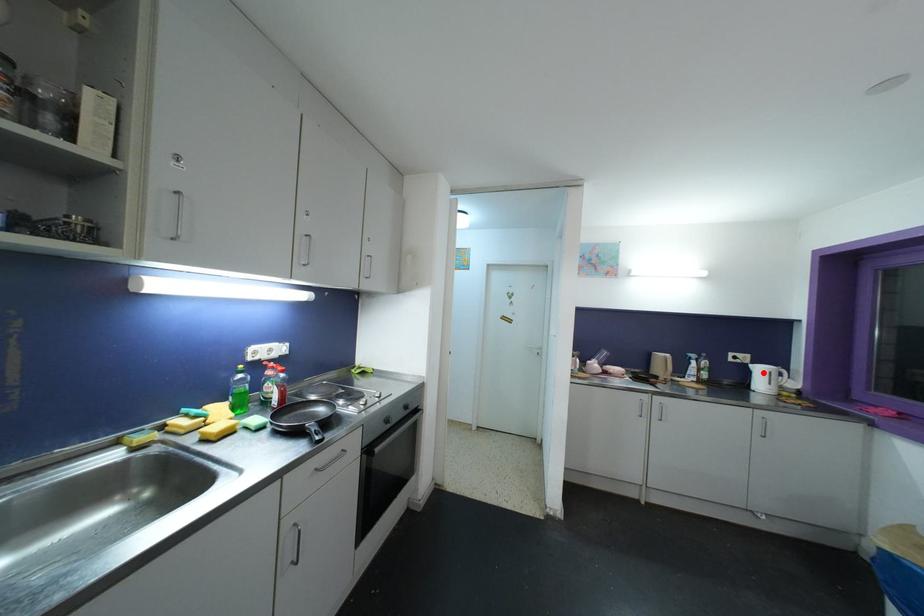
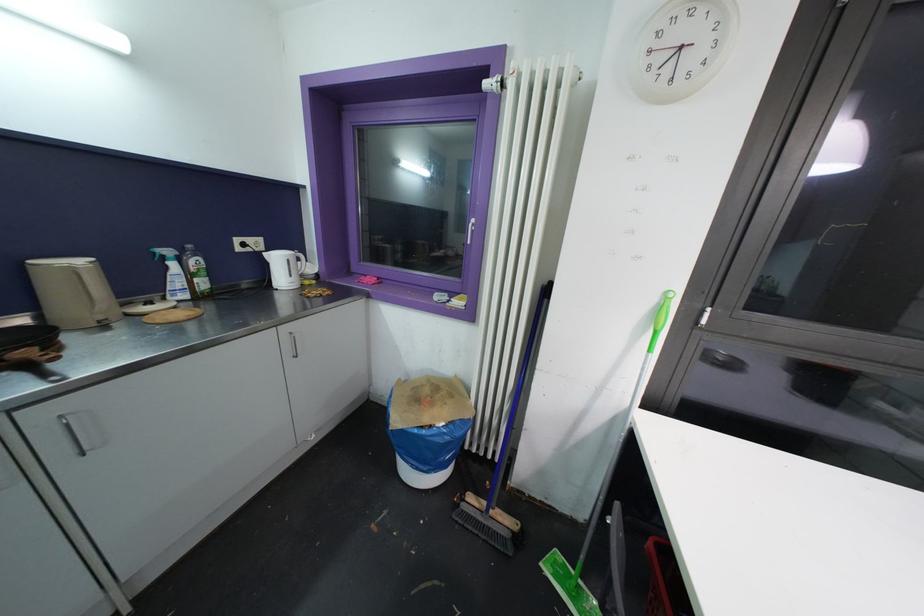
Question: I am providing you with two images of the same scene from different viewpoints. A red point is marked on the first image. Can you still see the location of the red point in image 2?

Choices:
 (A) Yes
 (B) No

Answer: (A)